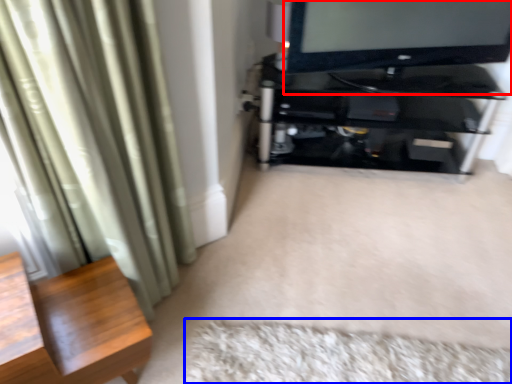
Question: Which object appears farthest to the camera in this image, television (highlighted by a red box) or mat (highlighted by a blue box)?

Choices:
 (A) television
 (B) mat

Answer: (A)